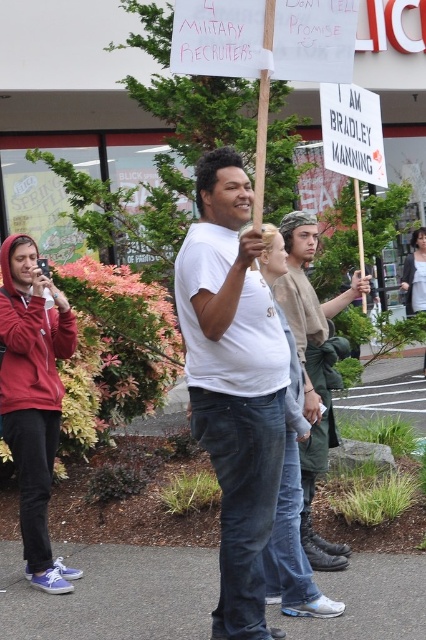
Is point (48, 416) positioned after point (285, 276)?

Yes.

How distant is matte red hoodie at left from khaki cotton shirt at center?

They are 4.92 feet apart.

Image resolution: width=426 pixels, height=640 pixels. Describe the element at coordinates (32, 397) in the screenshot. I see `matte red hoodie at left` at that location.

Where is `matte red hoodie at left`? The height and width of the screenshot is (640, 426). matte red hoodie at left is located at coordinates (32, 397).

Is white matte t-shirt at center bigger than khaki cotton shirt at center?

No.

Which is more to the right, white matte t-shirt at center or khaki cotton shirt at center?

From the viewer's perspective, khaki cotton shirt at center appears more on the right side.

Where is `white matte t-shirt at center`? white matte t-shirt at center is located at coordinates (233, 381).

At what (x,y) coordinates should I click in order to perform the action: click on white matte t-shirt at center. Please return your answer as a coordinate pair (x, y). The width and height of the screenshot is (426, 640). Looking at the image, I should click on (233, 381).

Between white matte t-shirt at center and matte red hoodie at left, which one is positioned higher?

white matte t-shirt at center is higher up.

The width and height of the screenshot is (426, 640). Describe the element at coordinates (233, 381) in the screenshot. I see `white matte t-shirt at center` at that location.

I want to click on white matte t-shirt at center, so click(x=233, y=381).